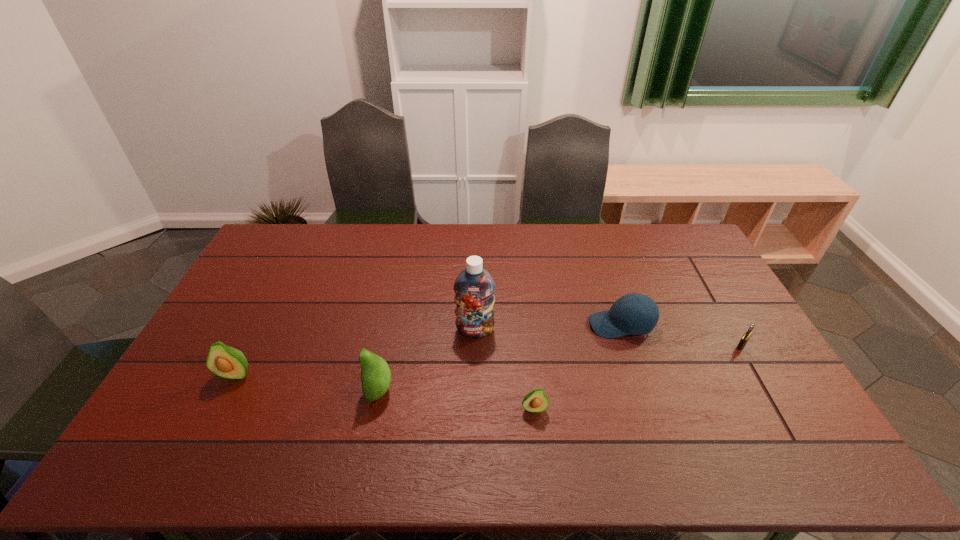
Identify the location of the second tallest avocado. Image resolution: width=960 pixels, height=540 pixels. (225, 361).

Where is `the fourth shortest object`? the fourth shortest object is located at coordinates [225, 361].

The height and width of the screenshot is (540, 960). What are the coordinates of `the second avocado from left to right` in the screenshot? It's located at (375, 374).

Where is `the third object from right to left`? the third object from right to left is located at coordinates (535, 401).

Where is `the rightmost avocado`? the rightmost avocado is located at coordinates (535, 401).

Identify the location of the rightmost object. Image resolution: width=960 pixels, height=540 pixels. (746, 336).

At what (x,y) coordinates should I click in order to perform the action: click on the third farthest object. Please return your answer as a coordinate pair (x, y). The height and width of the screenshot is (540, 960). Looking at the image, I should click on (746, 336).

Where is `the fifth object from left to right`? The width and height of the screenshot is (960, 540). the fifth object from left to right is located at coordinates (619, 321).

Image resolution: width=960 pixels, height=540 pixels. What are the coordinates of `shampoo` in the screenshot? It's located at (474, 287).

You are a GUI agent. You are given a task and a screenshot of the screen. Output one action in this format:
    pyautogui.click(x=<x>, y=<y>)
    Task: Click on the fourth object from right to left
    
    Given the screenshot: What is the action you would take?
    pyautogui.click(x=474, y=287)